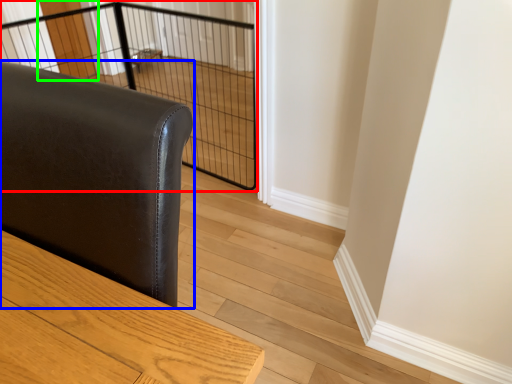
Question: Considering the real-world distances, which object is closest to cage (highlighted by a red box)? furniture (highlighted by a blue box) or screen door (highlighted by a green box).

Choices:
 (A) furniture
 (B) screen door

Answer: (B)